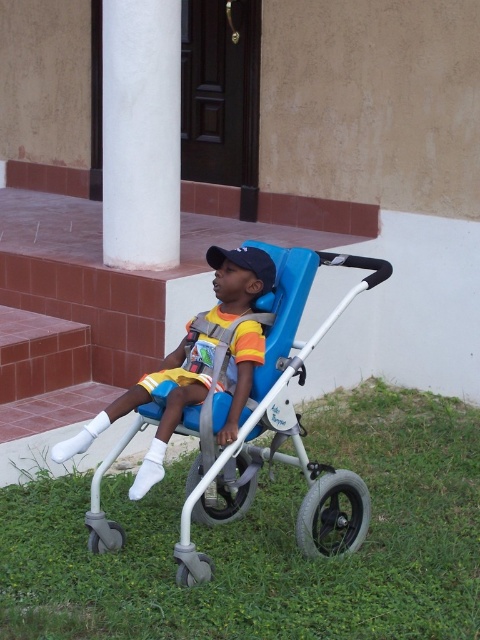
You are a photographer setting up a shot of the child in the blue and white mobility aid. You want to position your camera so that the white smooth column at upper left is on the left side of the frame and the green grass at lower center is on the right side. Is this arrangement possible based on their current positions?

Yes, because the green grass at lower center is already positioned to the right of the white smooth column at upper left, so arranging the camera to have the column on the left and the grass on the right aligns with their existing spatial relationship.

You are a landscape architect designing a garden path. You need to place the green grass at lower center and the white smooth column at upper left in such a way that they are both visible from the main entrance. Given their sizes, which object should be placed closer to the entrance to ensure visibility?

The white smooth column at upper left should be placed closer to the entrance because it is smaller in size compared to the green grass at lower center, which is larger and can be seen from a distance even if placed farther back.

You are a caregiver trying to move the blue plastic baby carriage at center to a different location. The green grass at lower center is where the baby carriage is currently placed. Is there enough space to move the baby carriage forward without moving it onto the grass?

The green grass at lower center is located below the blue plastic baby carriage at center, which means the carriage is already on the grass. There is no space mentioned for moving it forward without staying on the grass.